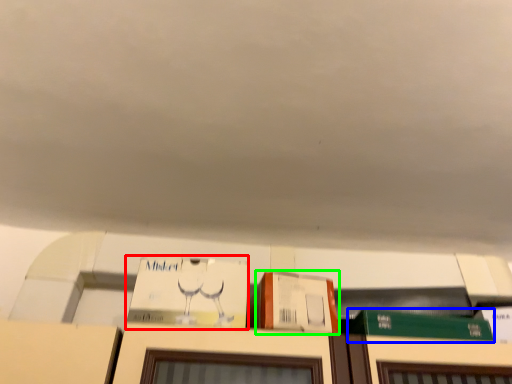
Question: Based on their relative distances, which object is farther from book (highlighted by a red box)? Choose from book (highlighted by a blue box) and cardboard box (highlighted by a green box).

Choices:
 (A) book
 (B) cardboard box

Answer: (A)